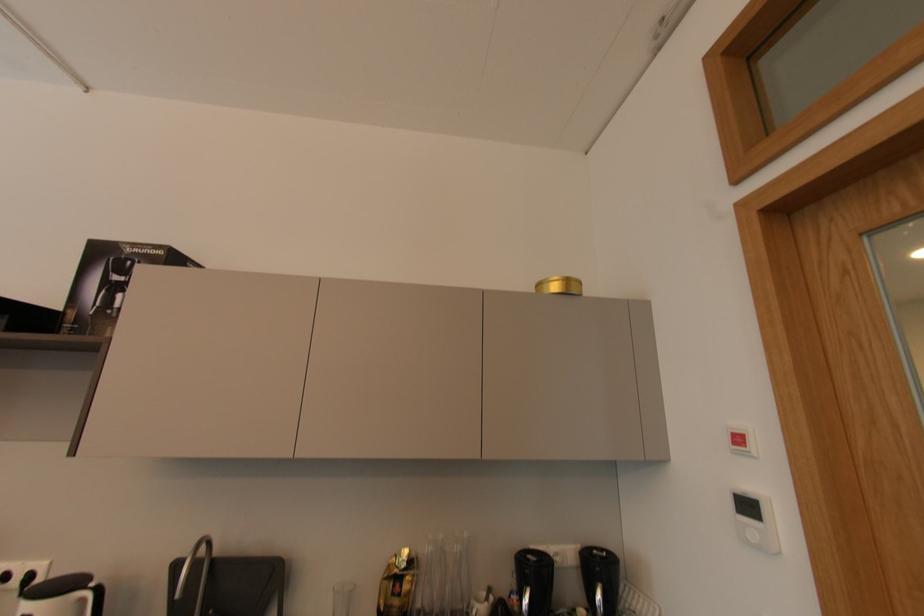
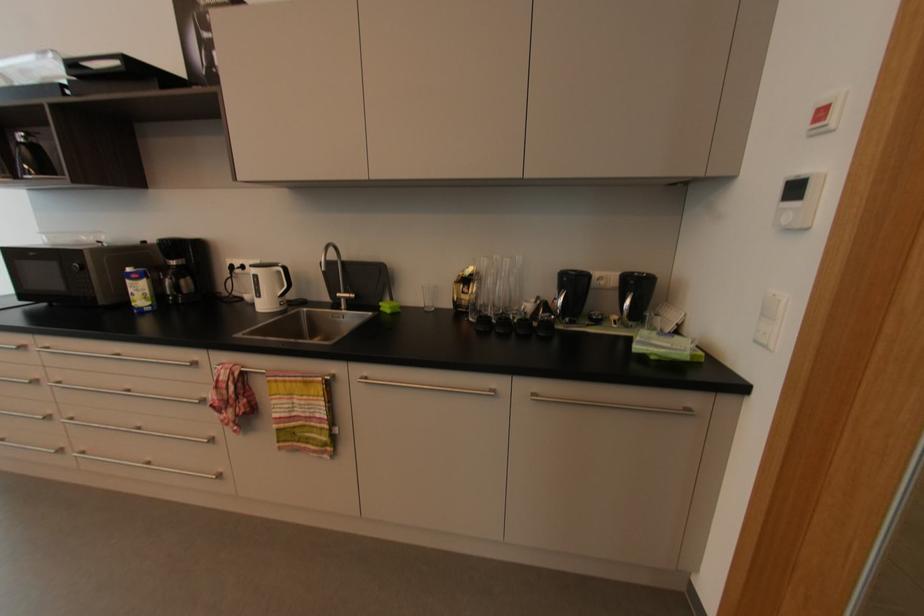
Locate, in the second image, the point that corresponds to [740,427] in the first image.

(832, 99)